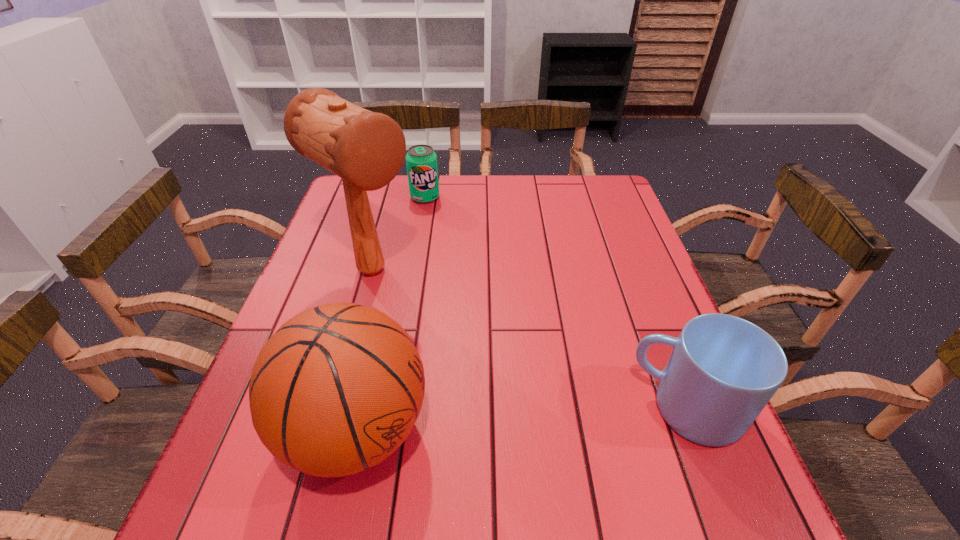
This screenshot has height=540, width=960. In order to click on free area in between the tallest object and the rightmost object in this screenshot , I will do click(530, 340).

Locate an element on the screen. The width and height of the screenshot is (960, 540). empty location between the third shortest object and the mug is located at coordinates (522, 420).

Locate an element on the screen. free space between the basketball and the mug is located at coordinates (522, 420).

The image size is (960, 540). I want to click on free point between the basketball and the pop soda, so pos(391,314).

You are a GUI agent. You are given a task and a screenshot of the screen. Output one action in this format:
    pyautogui.click(x=<x>, y=<y>)
    Task: Click on the closest object to the mallet
    
    Given the screenshot: What is the action you would take?
    pyautogui.click(x=421, y=161)

What are the coordinates of `the third closest object to the rightmost object` in the screenshot? It's located at (421, 161).

Find the location of a particular element. The height and width of the screenshot is (540, 960). free point that satisfies the following two spatial constraints: 1. on the front side of the mug; 2. on the right side of the farthest object is located at coordinates (389, 410).

Locate an element on the screen. free space that satisfies the following two spatial constraints: 1. on the back side of the tallest object; 2. on the right side of the pop soda is located at coordinates (393, 198).

You are a GUI agent. You are given a task and a screenshot of the screen. Output one action in this format:
    pyautogui.click(x=<x>, y=<y>)
    Task: Click on the free region that satisfies the following two spatial constraints: 1. on the back side of the basketball; 2. on the left side of the farthest object
    
    Given the screenshot: What is the action you would take?
    pyautogui.click(x=409, y=198)

At what (x,y) coordinates should I click in order to perform the action: click on vacant space that satisfies the following two spatial constraints: 1. on the front side of the rightmost object; 2. on the left side of the third nearest object. Please return your answer as a coordinate pair (x, y). This screenshot has height=540, width=960. Looking at the image, I should click on (334, 410).